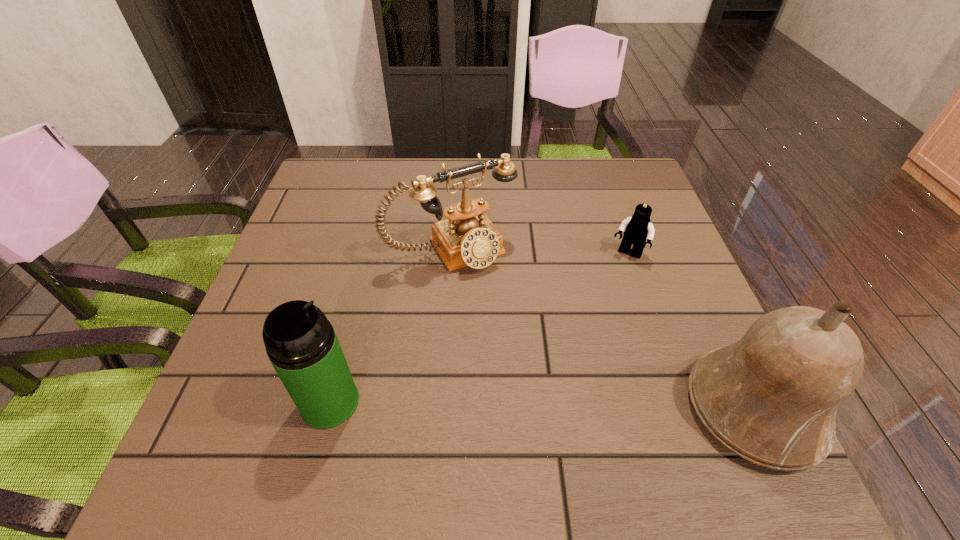
Locate an element on the screen. vacant point located on the dial number of the second shortest object is located at coordinates (527, 345).

You are a GUI agent. You are given a task and a screenshot of the screen. Output one action in this format:
    pyautogui.click(x=<x>, y=<y>)
    Task: Click on the vacant space located 0.330m on the dial number of the second shortest object
    The image size is (960, 540).
    Given the screenshot: What is the action you would take?
    pyautogui.click(x=558, y=390)

At what (x,y) coordinates should I click in order to perform the action: click on thermos bottle that is at the near edge. Please return your answer as a coordinate pair (x, y). The image size is (960, 540). Looking at the image, I should click on (301, 344).

Locate an element on the screen. bell located at the near edge is located at coordinates (772, 397).

This screenshot has width=960, height=540. I want to click on object that is at the left edge, so click(301, 344).

Locate an element on the screen. bell located in the right edge section of the desktop is located at coordinates (772, 397).

This screenshot has width=960, height=540. What are the coordinates of `Lego that is positioned at the right edge` in the screenshot? It's located at (637, 229).

At what (x,y) coordinates should I click in order to perform the action: click on object situated at the near left corner. Please return your answer as a coordinate pair (x, y). The width and height of the screenshot is (960, 540). Looking at the image, I should click on (301, 344).

Find the location of a particular element. object at the near right corner is located at coordinates (772, 397).

Locate an element on the screen. This screenshot has width=960, height=540. blank area at the far edge is located at coordinates (573, 168).